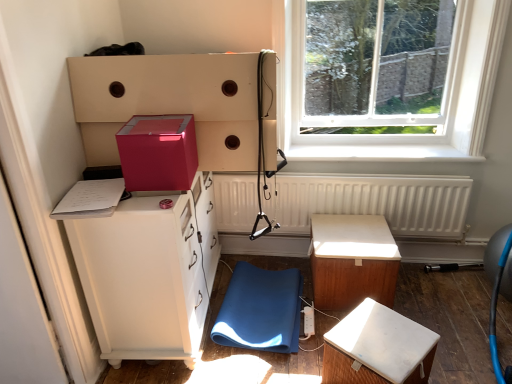
Question: In the image, is matte white cabinet at left on the left side or the right side of blue fabric swivel chair at lower center?

Choices:
 (A) right
 (B) left

Answer: (B)

Question: Is point (185, 258) positioned closer to the camera than point (245, 281)?

Choices:
 (A) closer
 (B) farther

Answer: (A)

Question: Based on their relative distances, which object is nearer to the blue fabric swivel chair at lower center?

Choices:
 (A) matte pink box at upper left
 (B) wooden table at center
 (C) white matte stool at lower right
 (D) matte pink cube at upper center
 (E) white plastic power strip at lower center

Answer: (E)

Question: Considering the real-world distances, which object is farthest from the blue fabric swivel chair at lower center?

Choices:
 (A) matte pink box at upper left
 (B) white matte radiator at center
 (C) white plastic power strip at lower center
 (D) wooden table at center
 (E) transparent glass window at upper right

Answer: (E)